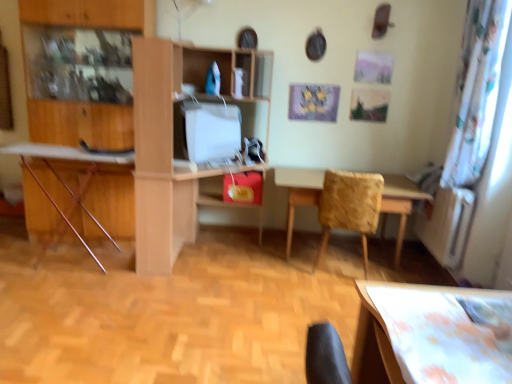
The image size is (512, 384). In order to click on vacant area situated below light wood/wooden desk at center (from a real-world perspective) in this screenshot , I will do `click(214, 249)`.